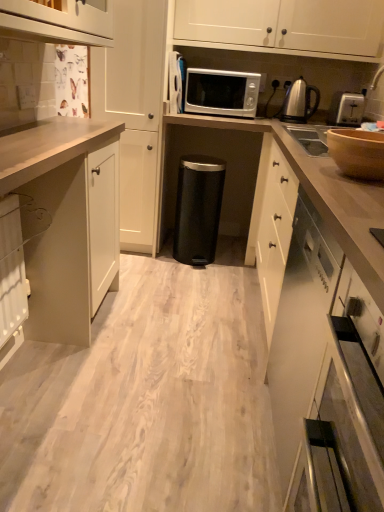
Question: From a real-world perspective, is black matte trash can at center below polished stainless steel kettle at upper right?

Choices:
 (A) yes
 (B) no

Answer: (A)

Question: Are black matte trash can at center and polished stainless steel kettle at upper right far apart?

Choices:
 (A) yes
 (B) no

Answer: (A)

Question: Does black matte trash can at center turn towards polished stainless steel kettle at upper right?

Choices:
 (A) no
 (B) yes

Answer: (A)

Question: Is black matte trash can at center outside polished stainless steel kettle at upper right?

Choices:
 (A) yes
 (B) no

Answer: (A)

Question: Is black matte trash can at center touching polished stainless steel kettle at upper right?

Choices:
 (A) yes
 (B) no

Answer: (B)

Question: From the image's perspective, is white matte cabinet at upper center, acting as the 1th cabinetry starting from the back, positioned above or below black matte trash can at center?

Choices:
 (A) above
 (B) below

Answer: (A)

Question: Is white matte cabinet at upper center, acting as the 1th cabinetry starting from the back, bigger or smaller than black matte trash can at center?

Choices:
 (A) big
 (B) small

Answer: (A)

Question: From a real-world perspective, is white matte cabinet at upper center, which is the 4th cabinetry from front to back, positioned above or below black matte trash can at center?

Choices:
 (A) below
 (B) above

Answer: (B)

Question: Is white matte cabinet at upper center, acting as the 1th cabinetry starting from the back, wider or thinner than black matte trash can at center?

Choices:
 (A) wide
 (B) thin

Answer: (B)

Question: From a real-world perspective, is white matte cabinet at upper center, acting as the 1th cabinetry starting from the back, positioned above or below matte white cabinet at left, which is the second cabinetry in front-to-back order?

Choices:
 (A) below
 (B) above

Answer: (B)

Question: Is white matte cabinet at upper center, acting as the 1th cabinetry starting from the back, taller or shorter than matte white cabinet at left, which is the second cabinetry in front-to-back order?

Choices:
 (A) tall
 (B) short

Answer: (B)

Question: Looking at their shapes, would you say white matte cabinet at upper center, acting as the 1th cabinetry starting from the back, is wider or thinner than matte white cabinet at left, acting as the third cabinetry starting from the back?

Choices:
 (A) thin
 (B) wide

Answer: (A)

Question: From the image's perspective, relative to matte white cabinet at left, which is the second cabinetry in front-to-back order, is white matte cabinet at upper center, acting as the 1th cabinetry starting from the back, above or below?

Choices:
 (A) above
 (B) below

Answer: (A)

Question: From the image's perspective, relative to wooden bowl at upper right, is black matte trash can at center above or below?

Choices:
 (A) above
 (B) below

Answer: (B)

Question: Is black matte trash can at center in front of or behind wooden bowl at upper right in the image?

Choices:
 (A) front
 (B) behind

Answer: (B)